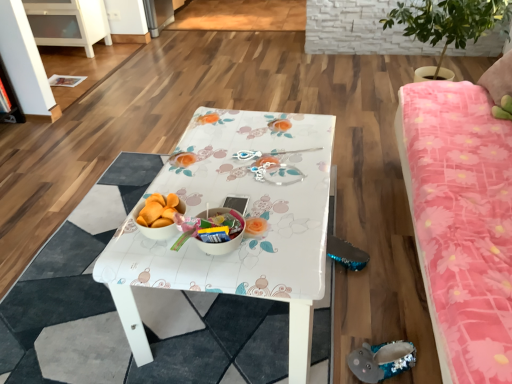
I want to click on free space in front of white glossy bowl at center, so 228,274.